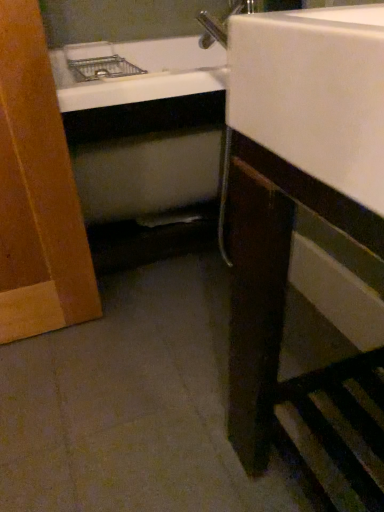
Question: Should I look upward or downward to see white glossy cabinet at lower right?

Choices:
 (A) down
 (B) up

Answer: (A)